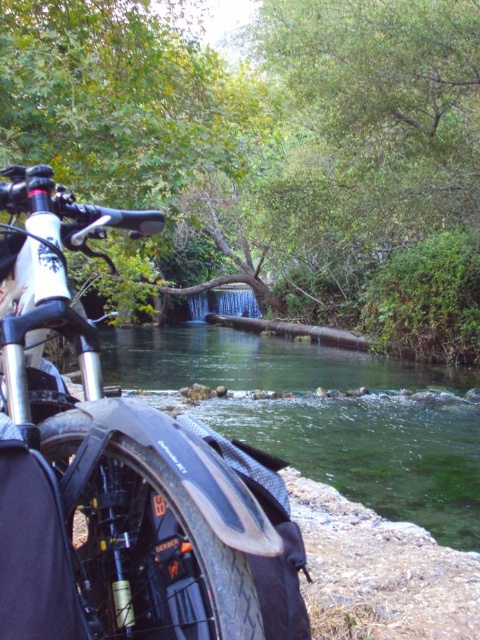
You are standing at the point labeled point [52,572] and want to walk towards the point labeled point [437,429]. Which direction should you face to move towards it?

You should face towards the upper left direction because point [437,429] is located above and to the left of point [52,572].

You are standing at the point marked by the coordinates point (105, 465) in the image. What object is located to your immediate left?

The shiny metallic bicycle at left is located to your immediate left.

You are a photographer planning to take a photo of the shiny metallic bicycle at left and the clear water at center. Based on their positions, which object should you focus on first if you want to capture both in a single shot without moving the camera?

The shiny metallic bicycle at left is to the left of clear water at center, so you should focus on the shiny metallic bicycle at left first to ensure both are in frame.